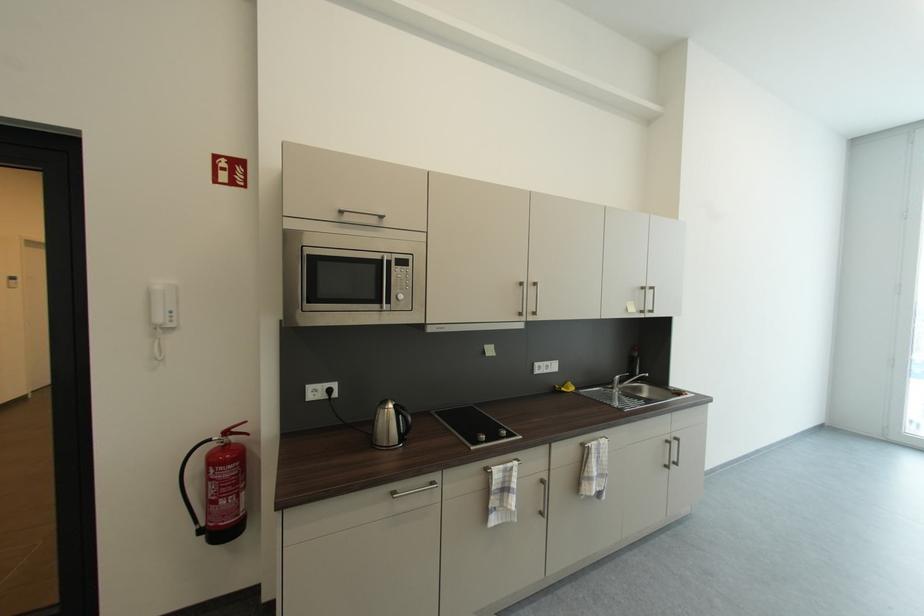
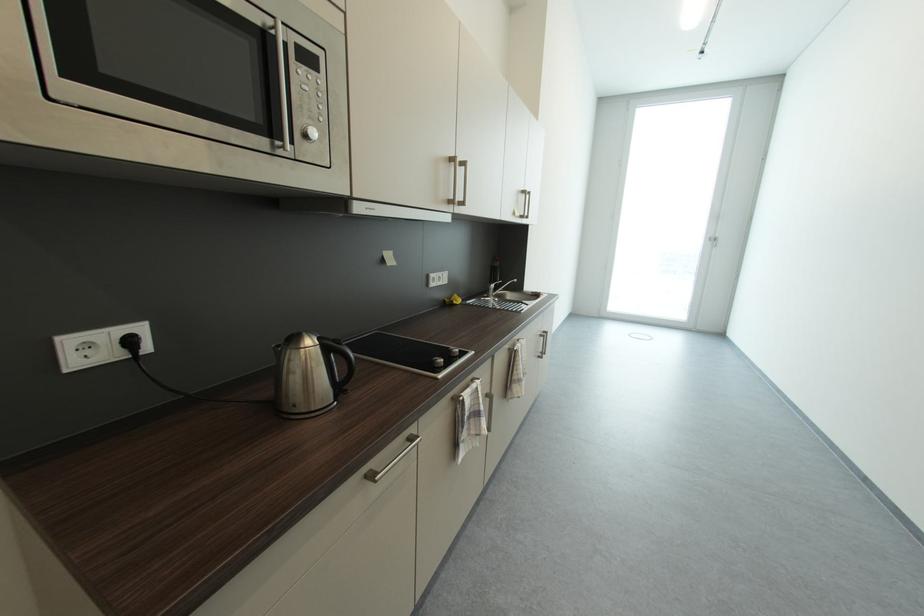
The point at (407, 299) is marked in the first image. Where is the corresponding point in the second image?

(321, 134)